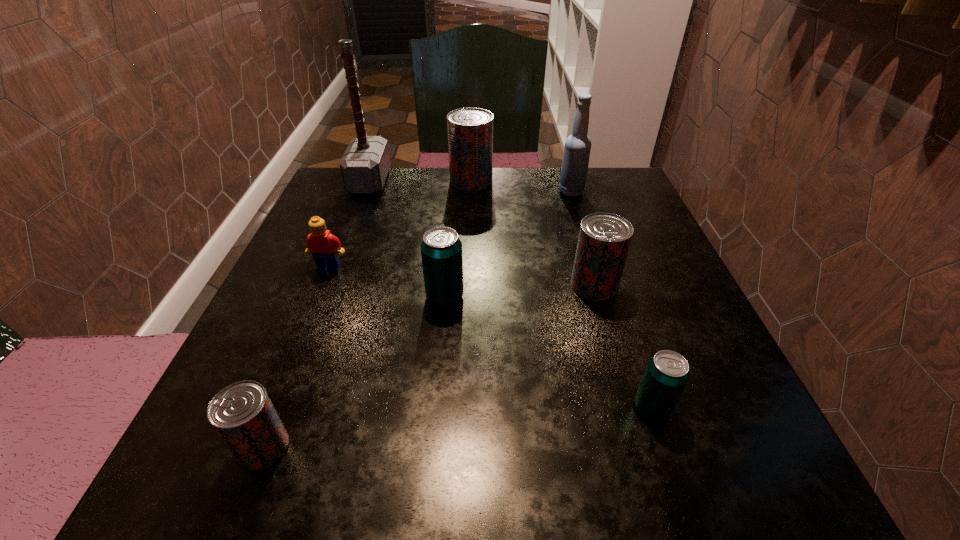
What are the coordinates of `free space located 0.320m on the back of the nearest beer can` in the screenshot? It's located at (331, 273).

I want to click on free space located 0.170m on the left of the nearer teal beer can, so click(514, 408).

Locate an element on the screen. Image resolution: width=960 pixels, height=540 pixels. hammer that is positioned at the far edge is located at coordinates (365, 164).

The width and height of the screenshot is (960, 540). In order to click on bottle that is at the far edge in this screenshot , I will do `click(577, 148)`.

Locate an element on the screen. beer can at the far edge is located at coordinates point(470,130).

Find the location of `object present at the near edge`. object present at the near edge is located at coordinates (242, 413).

The width and height of the screenshot is (960, 540). I want to click on hammer present at the left edge, so click(x=365, y=164).

Locate an element on the screen. Lego present at the left edge is located at coordinates (322, 245).

Identify the location of beer can located at the left edge. (242, 413).

The width and height of the screenshot is (960, 540). I want to click on bottle that is at the right edge, so click(x=577, y=148).